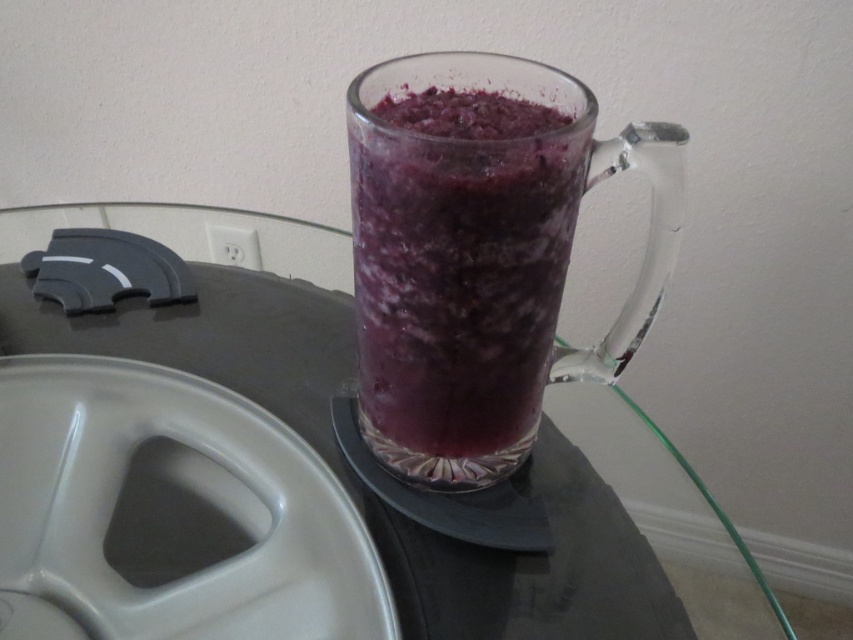
You are a guest at a party and see the purple translucent glass at center and the transparent glass table at center. If you want to pick up the glass, which object should you touch first?

You should touch the purple translucent glass at center first because it is in front of the transparent glass table at center, making it closer to your hand.

You are standing in front of a glass table with a mug of smoothie. There is a point marked at coordinates (459, 268). What object is located at that point?

The point at coordinates (459, 268) has the purple translucent glass at center.